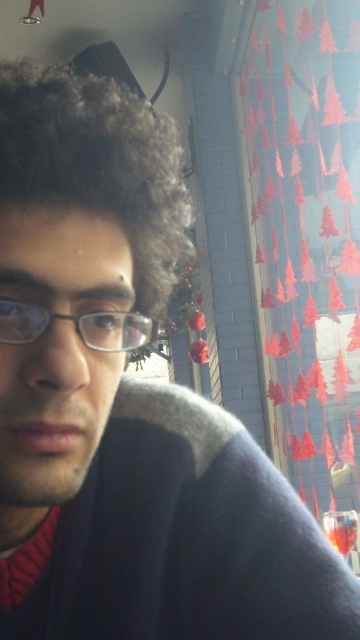
Is fuzzy brown hair at upper left behind matte black glasses at center?

That is True.

In the scene shown: Who is lower down, fuzzy brown hair at upper left or matte black glasses at center?

matte black glasses at center

Image resolution: width=360 pixels, height=640 pixels. I want to click on fuzzy brown hair at upper left, so click(x=97, y=164).